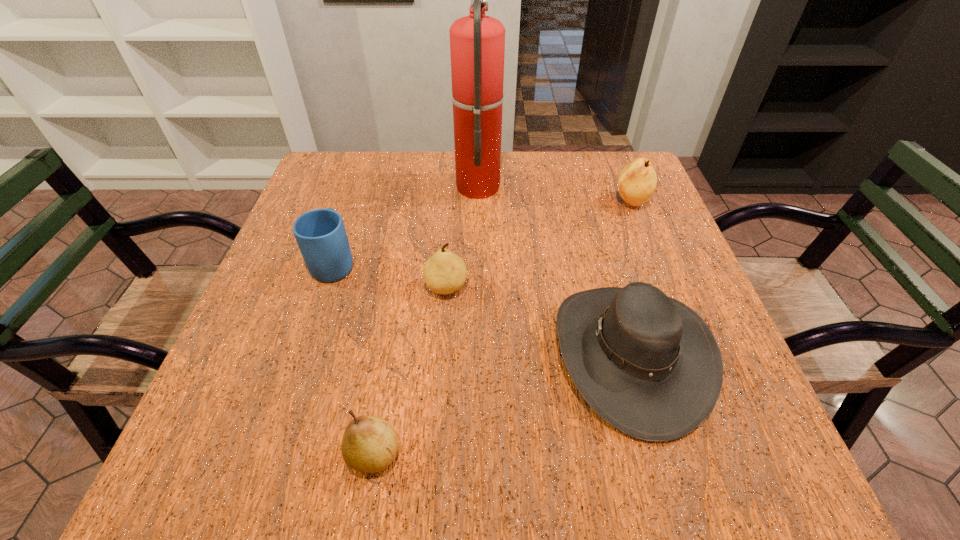
Find the location of a particular element. vacant region at the far right corner of the desktop is located at coordinates (636, 151).

At what (x,y) coordinates should I click in order to perform the action: click on vacant space in between the shortest pear and the mug. Please return your answer as a coordinate pair (x, y). Image resolution: width=960 pixels, height=540 pixels. Looking at the image, I should click on (354, 358).

The width and height of the screenshot is (960, 540). Find the location of `free space that is in between the farthest pear and the leftmost object`. free space that is in between the farthest pear and the leftmost object is located at coordinates (483, 233).

The width and height of the screenshot is (960, 540). I want to click on free space between the second nearest pear and the mug, so click(391, 275).

At what (x,y) coordinates should I click in order to perform the action: click on free spot between the second object from left to right and the fire extinguisher. Please return your answer as a coordinate pair (x, y). Looking at the image, I should click on (426, 319).

Find the location of a particular element. The width and height of the screenshot is (960, 540). unoccupied position between the shortest object and the cowboy hat is located at coordinates (503, 404).

In order to click on free space between the second pear from left to right and the fire extinguisher in this screenshot , I will do `click(462, 236)`.

Identify the location of free space between the second pear from left to right and the leftmost pear. (410, 370).

The image size is (960, 540). I want to click on free space between the fifth object from right to left and the cowboy hat, so [x=503, y=404].

I want to click on vacant area between the leftmost object and the second farthest pear, so click(x=391, y=275).